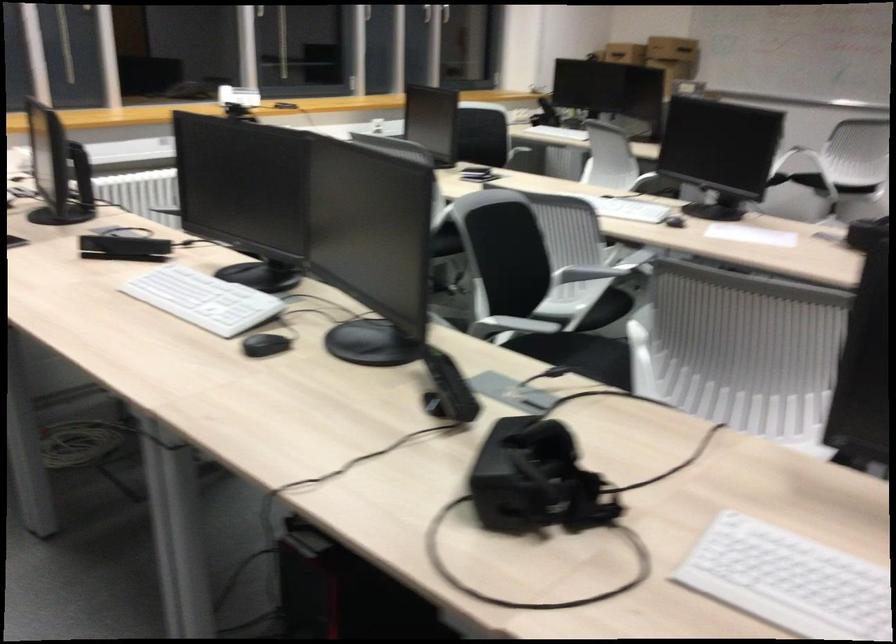
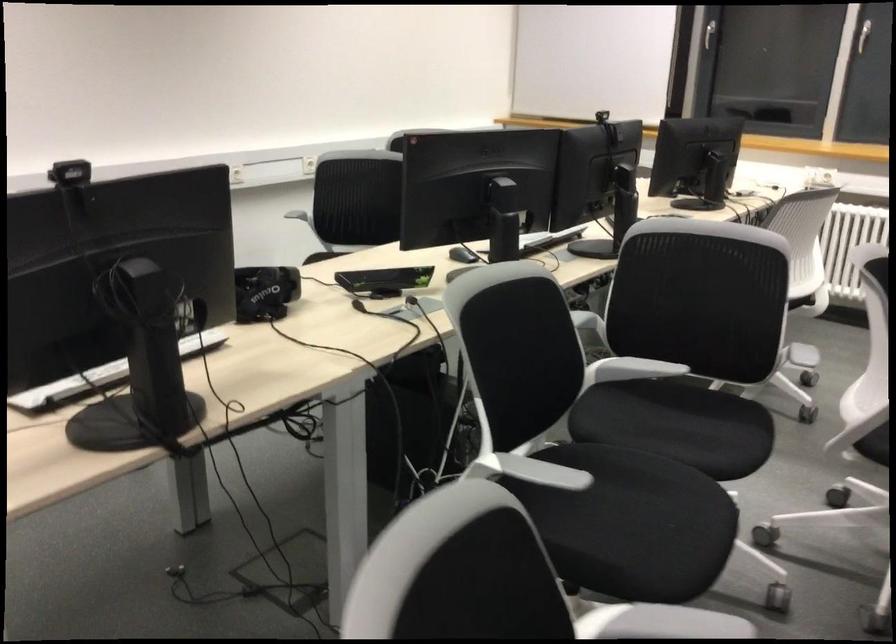
In the second image, find the point that corresponds to (x=643, y=323) in the first image.

(631, 368)